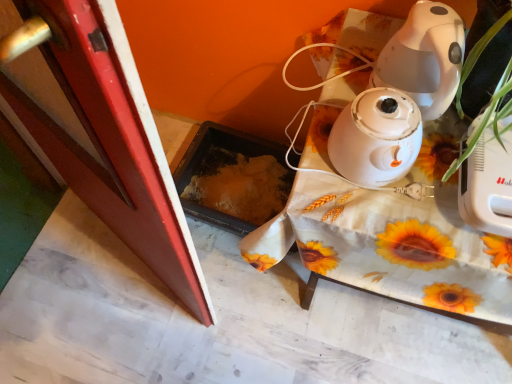
The image size is (512, 384). I want to click on free space in front of white glossy humidifier at center, so click(x=387, y=221).